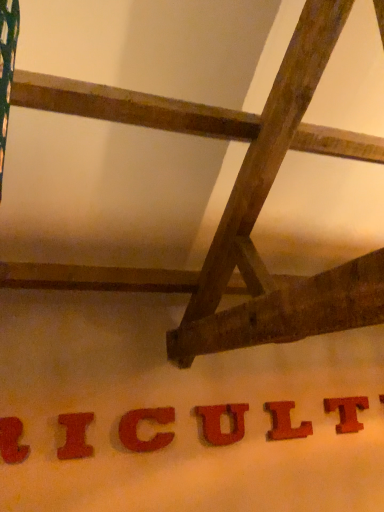
Question: Is rustic wood letter u at center, marked as the 4th letter in a left-to-right arrangement, next to matte red letter at lower left, which is the sixth letter from right to left?

Choices:
 (A) yes
 (B) no

Answer: (B)

Question: Considering the relative sizes of rustic wood letter u at center, marked as the 4th letter in a left-to-right arrangement, and matte red letter at lower left, which is the sixth letter from right to left, in the image provided, is rustic wood letter u at center, marked as the 4th letter in a left-to-right arrangement, thinner than matte red letter at lower left, which is the sixth letter from right to left,?

Choices:
 (A) no
 (B) yes

Answer: (B)

Question: Is rustic wood letter u at center, marked as the 4th letter in a left-to-right arrangement, outside matte red letter at lower left, the first letter when ordered from left to right?

Choices:
 (A) no
 (B) yes

Answer: (B)

Question: Does rustic wood letter u at center, the third letter positioned from the right, have a greater height compared to matte red letter at lower left, which is the sixth letter from right to left?

Choices:
 (A) no
 (B) yes

Answer: (A)

Question: Considering the relative sizes of rustic wood letter u at center, marked as the 4th letter in a left-to-right arrangement, and matte red letter at lower left, which is the sixth letter from right to left, in the image provided, is rustic wood letter u at center, marked as the 4th letter in a left-to-right arrangement, shorter than matte red letter at lower left, which is the sixth letter from right to left,?

Choices:
 (A) no
 (B) yes

Answer: (B)

Question: From the image's perspective, does rustic wood letter u at center, marked as the 4th letter in a left-to-right arrangement, appear higher than matte red letter at lower left, the first letter when ordered from left to right?

Choices:
 (A) yes
 (B) no

Answer: (B)

Question: Does matte red letter i at lower left, marked as the 5th letter in a right-to-left arrangement, have a lesser width compared to rustic wood letter u at center, marked as the 4th letter in a left-to-right arrangement?

Choices:
 (A) no
 (B) yes

Answer: (A)

Question: Does matte red letter i at lower left, the second letter positioned from the left, have a larger size compared to rustic wood letter u at center, the third letter positioned from the right?

Choices:
 (A) yes
 (B) no

Answer: (B)

Question: Considering the relative positions of matte red letter i at lower left, the second letter positioned from the left, and rustic wood letter u at center, the third letter positioned from the right, in the image provided, is matte red letter i at lower left, the second letter positioned from the left, to the right of rustic wood letter u at center, the third letter positioned from the right, from the viewer's perspective?

Choices:
 (A) no
 (B) yes

Answer: (A)

Question: Are matte red letter i at lower left, the second letter positioned from the left, and rustic wood letter u at center, the third letter positioned from the right, making contact?

Choices:
 (A) yes
 (B) no

Answer: (B)

Question: From the image's perspective, is matte red letter i at lower left, the second letter positioned from the left, below rustic wood letter u at center, the third letter positioned from the right?

Choices:
 (A) no
 (B) yes

Answer: (A)

Question: Is matte red letter i at lower left, the second letter positioned from the left, positioned with its back to rustic wood letter u at center, marked as the 4th letter in a left-to-right arrangement?

Choices:
 (A) yes
 (B) no

Answer: (B)

Question: From a real-world perspective, is matte red letter at lower left, the first letter when ordered from left to right, on top of red matte letter c at center, acting as the 3th letter starting from the left?

Choices:
 (A) yes
 (B) no

Answer: (A)